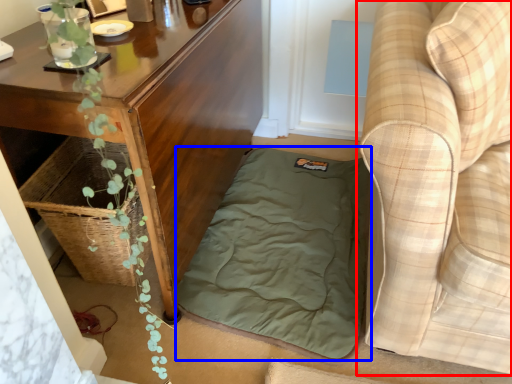
Question: Among these objects, which one is farthest to the camera, studio couch (highlighted by a red box) or mattress (highlighted by a blue box)?

Choices:
 (A) studio couch
 (B) mattress

Answer: (B)